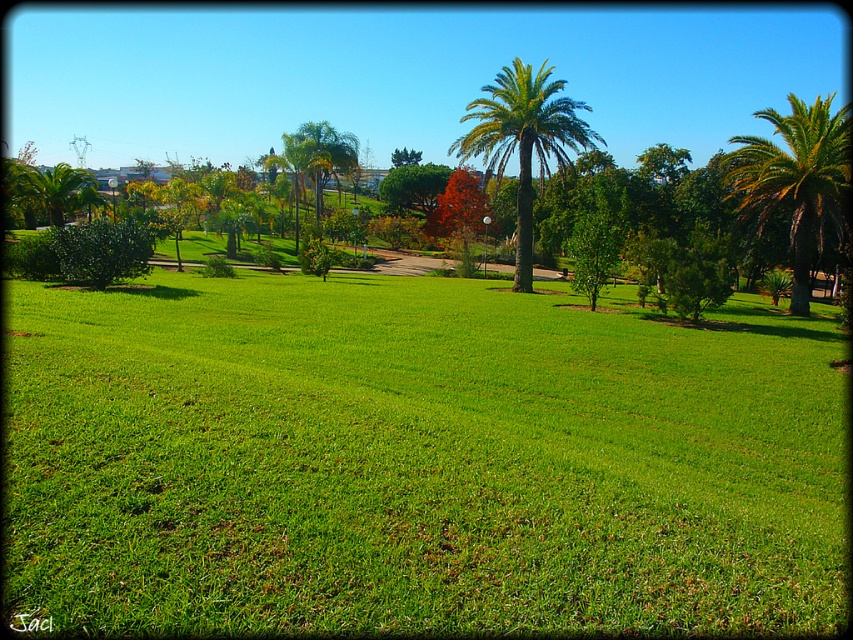
Question: Is green leafy palm tree at right bigger than green leafy palm at center?

Choices:
 (A) yes
 (B) no

Answer: (A)

Question: Estimate the real-world distances between objects in this image. Which object is closer to the green leafy palm tree at right?

Choices:
 (A) green leafy palm at center
 (B) green grass at center

Answer: (B)

Question: Can you confirm if green grass at center is bigger than green leafy palm at center?

Choices:
 (A) no
 (B) yes

Answer: (A)

Question: Which object is positioned farthest from the green leafy palm at center?

Choices:
 (A) green grass at center
 (B) green leafy palm tree at right

Answer: (B)

Question: Among these objects, which one is farthest from the camera?

Choices:
 (A) green grass at center
 (B) green leafy palm at center
 (C) green leafy palm tree at right

Answer: (B)

Question: Does green grass at center have a lesser width compared to green leafy palm at center?

Choices:
 (A) yes
 (B) no

Answer: (A)